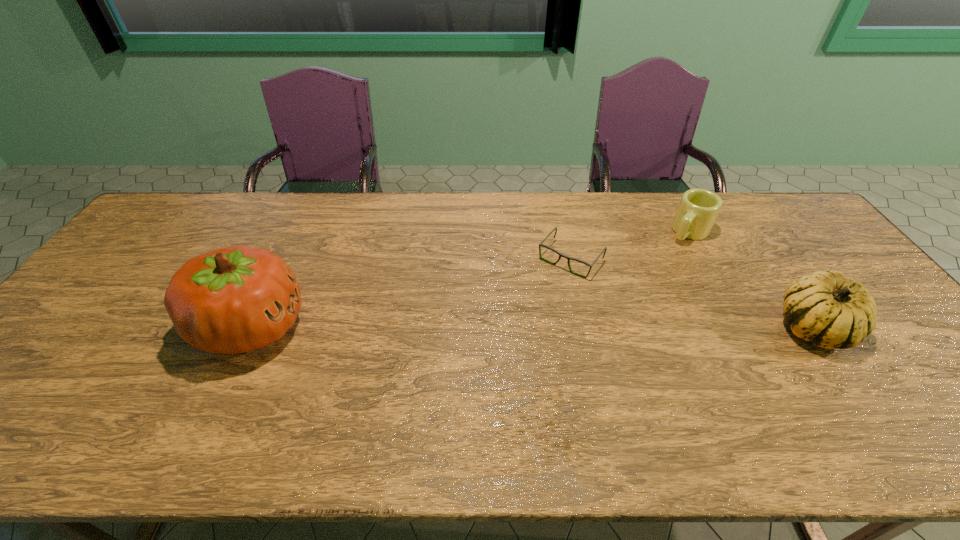
Find the location of a particular element. vacant area situated with the handle on the side of the third object from left to right is located at coordinates (630, 298).

You are a GUI agent. You are given a task and a screenshot of the screen. Output one action in this format:
    pyautogui.click(x=<x>, y=<y>)
    Task: Click on the free region located 0.330m with the handle on the side of the third object from left to right
    
    Given the screenshot: What is the action you would take?
    pyautogui.click(x=628, y=299)

This screenshot has height=540, width=960. What are the coordinates of `vacant space located 0.140m with the handle on the side of the third object from left to right` in the screenshot? It's located at (660, 265).

Identify the location of free space located 0.370m on the lens of the third object from right to left. The width and height of the screenshot is (960, 540). (481, 364).

Identify the location of vacant space located on the lens of the third object from right to left. The height and width of the screenshot is (540, 960). (510, 329).

Where is `vacant region located 0.130m on the lens of the third object from right to left`? The height and width of the screenshot is (540, 960). vacant region located 0.130m on the lens of the third object from right to left is located at coordinates (532, 304).

Where is `object that is positioned at the far edge`? object that is positioned at the far edge is located at coordinates (698, 209).

Where is `object present at the right edge`? The image size is (960, 540). object present at the right edge is located at coordinates coord(831,311).

This screenshot has width=960, height=540. Identify the location of vacant space at the far edge of the desktop. (257, 213).

Identify the location of free region at the near edge of the desktop. Image resolution: width=960 pixels, height=540 pixels. pyautogui.click(x=367, y=385).